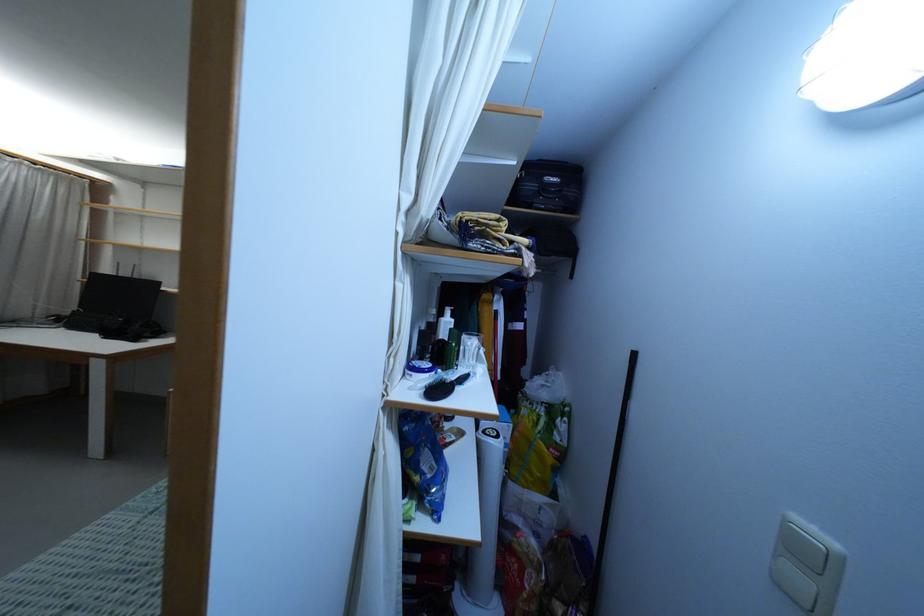
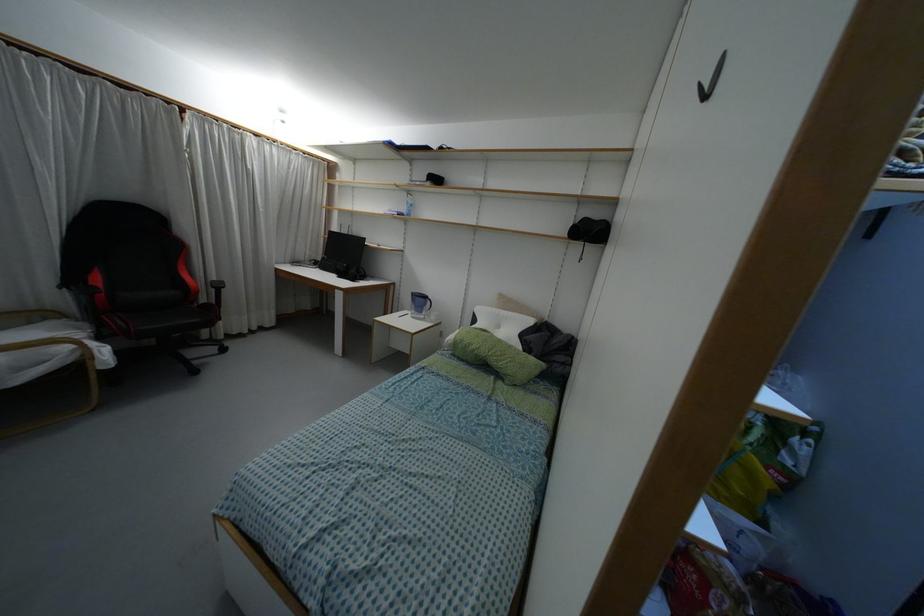
In the second image, find the point that corresponds to the point at 111,334 in the first image.

(341, 275)